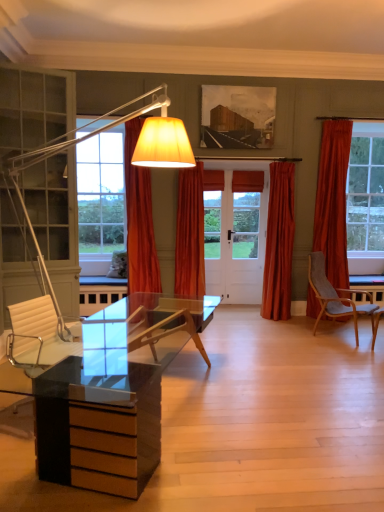
Question: Is orange velvet curtain at center, the second curtain when ordered from left to right, bigger or smaller than wooden textured painting at upper center?

Choices:
 (A) small
 (B) big

Answer: (B)

Question: Is orange velvet curtain at center, the second curtain when ordered from left to right, to the left or to the right of wooden textured painting at upper center in the image?

Choices:
 (A) right
 (B) left

Answer: (B)

Question: Which object is the closest to the orange fabric curtain at center, the 1th curtain positioned from the left?

Choices:
 (A) wooden textured painting at upper center
 (B) orange velvet curtain at center, which is the second curtain from right to left
 (C) velvet orange curtain at center, which ranks as the third curtain in left-to-right order
 (D) fluffy white pillow at left

Answer: (B)

Question: Which of these objects is positioned closest to the fluffy white pillow at left?

Choices:
 (A) orange fabric curtain at center, the 1th curtain positioned from the left
 (B) wooden textured painting at upper center
 (C) velvet orange curtain at center, marked as the 1th curtain in a right-to-left arrangement
 (D) orange velvet curtain at center, which is the second curtain from right to left

Answer: (A)